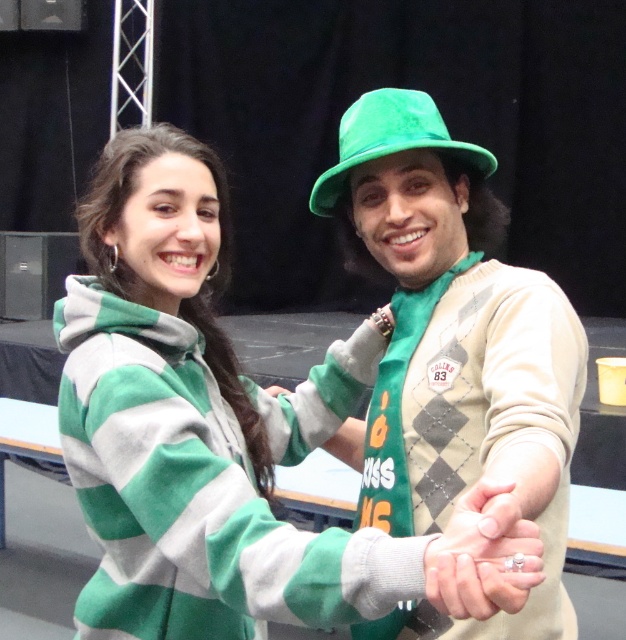
Where is `green felt hat at upper right`? green felt hat at upper right is located at coordinates (456, 364).

Does green felt hat at upper right have a smaller size compared to matte gold ring at center?

Actually, green felt hat at upper right might be larger than matte gold ring at center.

Locate an element on the screen. This screenshot has height=640, width=626. green felt hat at upper right is located at coordinates click(456, 364).

Between green striped hoodie at center and green fleece hoodie at center, which one is positioned higher?

green striped hoodie at center is above.

Does green striped hoodie at center lie in front of green fleece hoodie at center?

Yes, green striped hoodie at center is in front of green fleece hoodie at center.

Describe the element at coordinates (217, 433) in the screenshot. I see `green striped hoodie at center` at that location.

Identify the location of green striped hoodie at center. The width and height of the screenshot is (626, 640). (217, 433).

Which is behind, point (295, 550) or point (332, 212)?

The point (332, 212) is behind.

This screenshot has width=626, height=640. Describe the element at coordinates (175, 488) in the screenshot. I see `green fleece hoodie at center` at that location.

Is point (78, 394) behind point (416, 92)?

No, (78, 394) is closer to viewer.

Image resolution: width=626 pixels, height=640 pixels. I want to click on green fleece hoodie at center, so click(x=175, y=488).